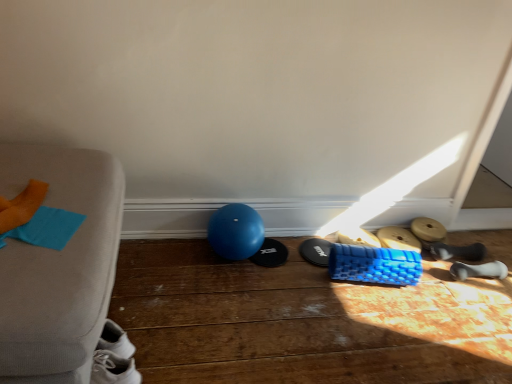
Identify the location of blank space situated above blue textured foam roller at lower right, which is counted as the fourth footwear, starting from the right (from a real-world perspective). The width and height of the screenshot is (512, 384). (401, 238).